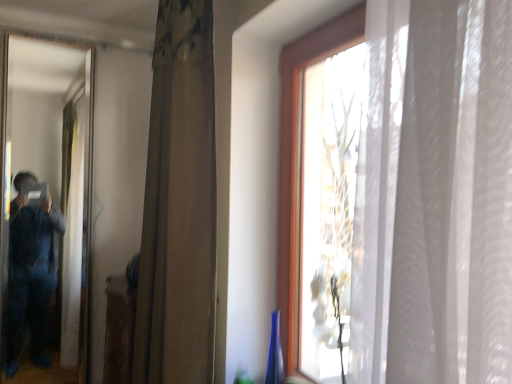
I want to click on matte black mirror at left, so click(48, 193).

This screenshot has width=512, height=384. What do you see at coordinates (48, 193) in the screenshot?
I see `matte black mirror at left` at bounding box center [48, 193].

Measure the distance between point (54, 131) and camera.

Point (54, 131) and camera are 1.91 meters apart.

What do you see at coordinates (179, 204) in the screenshot? The height and width of the screenshot is (384, 512). I see `brown textured curtain at center` at bounding box center [179, 204].

This screenshot has width=512, height=384. I want to click on brown textured curtain at center, so click(179, 204).

Find the location of a particular element. The height and width of the screenshot is (384, 512). matte black mirror at left is located at coordinates pyautogui.click(x=48, y=193).

In the scene shown: In the image, is matte black mirror at left on the left side or the right side of brown textured curtain at center?

Based on their positions, matte black mirror at left is located to the left of brown textured curtain at center.

Considering the positions of objects matte black mirror at left and brown textured curtain at center in the image provided, who is behind, matte black mirror at left or brown textured curtain at center?

matte black mirror at left is further away from the camera.

Does point (16, 265) come farther from viewer compared to point (183, 152)?

Yes, it is behind point (183, 152).

From the image's perspective, is matte black mirror at left located above brown textured curtain at center?

No.

From a real-world perspective, is matte black mirror at left over brown textured curtain at center?

Incorrect, from a real-world perspective, matte black mirror at left is lower than brown textured curtain at center.

Between matte black mirror at left and brown textured curtain at center, which one has larger width?

Wider between the two is brown textured curtain at center.

From their relative heights in the image, would you say matte black mirror at left is taller or shorter than brown textured curtain at center?

matte black mirror at left is taller than brown textured curtain at center.

Can you confirm if matte black mirror at left is bigger than brown textured curtain at center?

No.

Is matte black mirror at left situated inside brown textured curtain at center or outside?

matte black mirror at left is not inside brown textured curtain at center, it's outside.

Are matte black mirror at left and brown textured curtain at center making contact?

They are not placed beside each other.

Is matte black mirror at left looking in the opposite direction of brown textured curtain at center?

matte black mirror at left does not have its back to brown textured curtain at center.

How many degrees apart are the facing directions of matte black mirror at left and brown textured curtain at center?

matte black mirror at left and brown textured curtain at center are facing 91.4 degrees away from each other.

At what (x,y) coordinates should I click in order to perform the action: click on curtain above the matte black mirror at left (from a real-world perspective). Please return your answer as a coordinate pair (x, y). The width and height of the screenshot is (512, 384). Looking at the image, I should click on (179, 204).

Is brown textured curtain at center at the right side of matte black mirror at left?

Indeed, brown textured curtain at center is positioned on the right side of matte black mirror at left.

Which object is closer to the camera taking this photo, brown textured curtain at center or matte black mirror at left?

brown textured curtain at center is closer to the camera.

Between point (201, 355) and point (87, 178), which one is positioned in front?

The point (201, 355) is closer.

From the image's perspective, is brown textured curtain at center over matte black mirror at left?

Indeed, from the image's perspective, brown textured curtain at center is shown above matte black mirror at left.

From a real-world perspective, is brown textured curtain at center positioned over matte black mirror at left based on gravity?

Yes, from a real-world perspective, brown textured curtain at center is over matte black mirror at left

Does brown textured curtain at center have a lesser width compared to matte black mirror at left?

Incorrect, the width of brown textured curtain at center is not less than that of matte black mirror at left.

Can you confirm if brown textured curtain at center is taller than matte black mirror at left?

No, brown textured curtain at center is not taller than matte black mirror at left.

Who is smaller, brown textured curtain at center or matte black mirror at left?

With smaller size is matte black mirror at left.

Would you say brown textured curtain at center is outside matte black mirror at left?

Yes, brown textured curtain at center is outside of matte black mirror at left.

Is brown textured curtain at center not close to matte black mirror at left?

Actually, brown textured curtain at center and matte black mirror at left are a little close together.

Is brown textured curtain at center facing away from matte black mirror at left?

No, brown textured curtain at center is not facing away from matte black mirror at left.

How distant is brown textured curtain at center from matte black mirror at left?

A distance of 32.06 inches exists between brown textured curtain at center and matte black mirror at left.

Locate an element on the screen. This screenshot has width=512, height=384. curtain to the right of matte black mirror at left is located at coordinates (179, 204).

The width and height of the screenshot is (512, 384). Find the location of `curtain above the matte black mirror at left (from a real-world perspective)`. curtain above the matte black mirror at left (from a real-world perspective) is located at coordinates (179, 204).

Locate an element on the screen. curtain above the matte black mirror at left (from the image's perspective) is located at coordinates (179, 204).